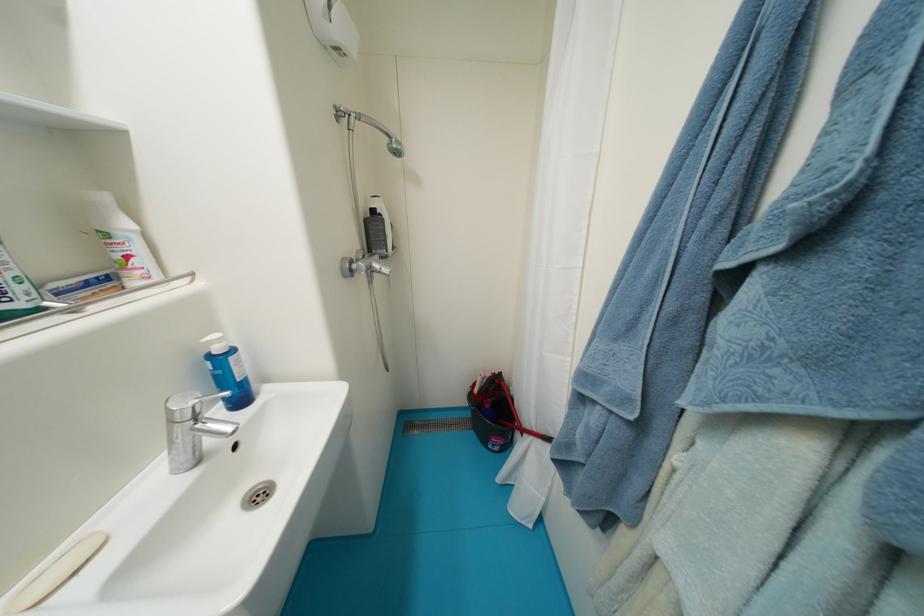
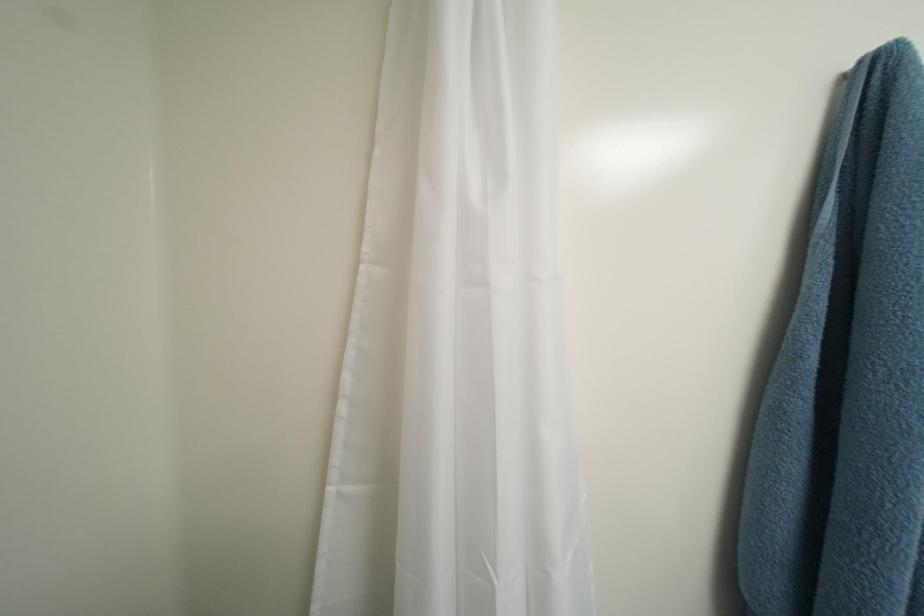
Question: The images are taken continuously from a first-person perspective. In which direction is your viewpoint rotating?

Choices:
 (A) Left
 (B) Right
 (C) Up
 (D) Down

Answer: (B)